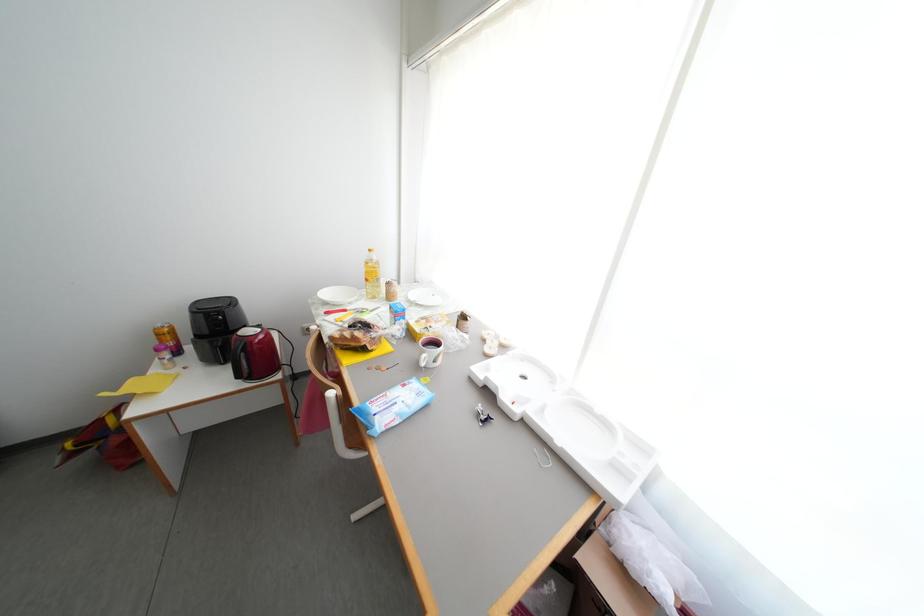
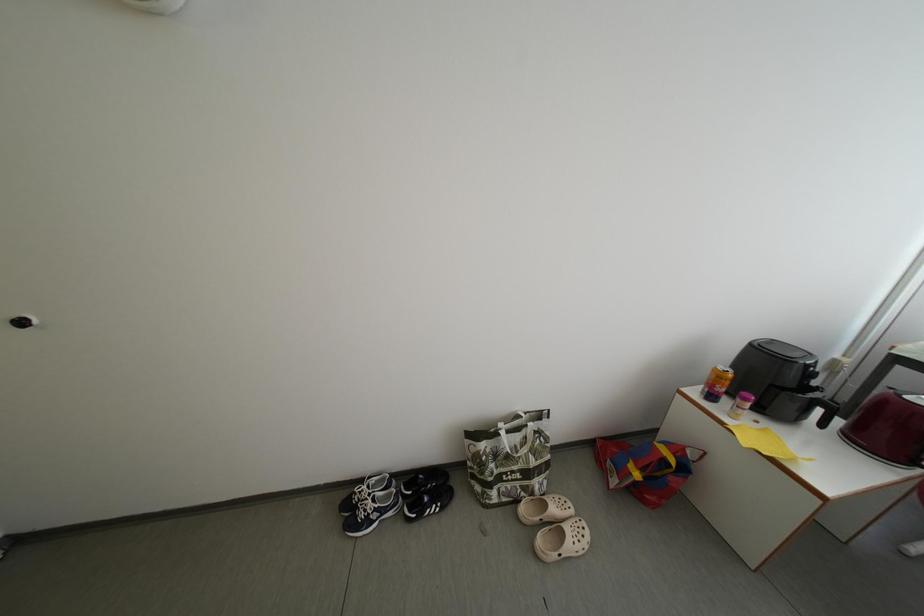
Question: In a continuous first-person perspective shot, in which direction is the camera moving?

Choices:
 (A) Left
 (B) Right
 (C) Forward
 (D) Backward

Answer: (A)